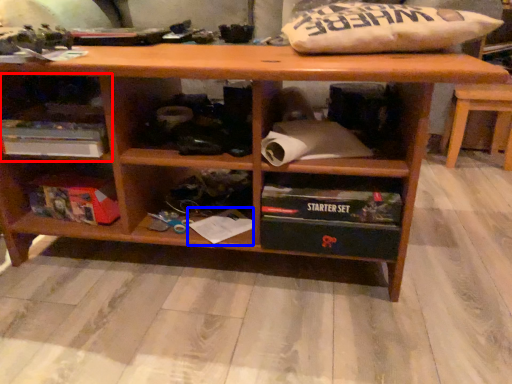
Question: Among these objects, which one is farthest to the camera, shelf (highlighted by a red box) or book (highlighted by a blue box)?

Choices:
 (A) shelf
 (B) book

Answer: (B)